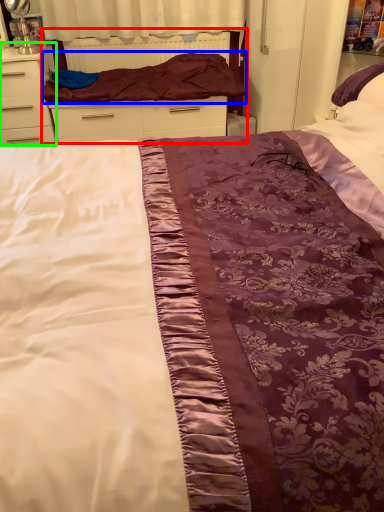
Question: Based on their relative distances, which object is nearer to bed frame (highlighted by a red box)? Choose from blanket (highlighted by a blue box) and chest of drawers (highlighted by a green box).

Choices:
 (A) blanket
 (B) chest of drawers

Answer: (A)